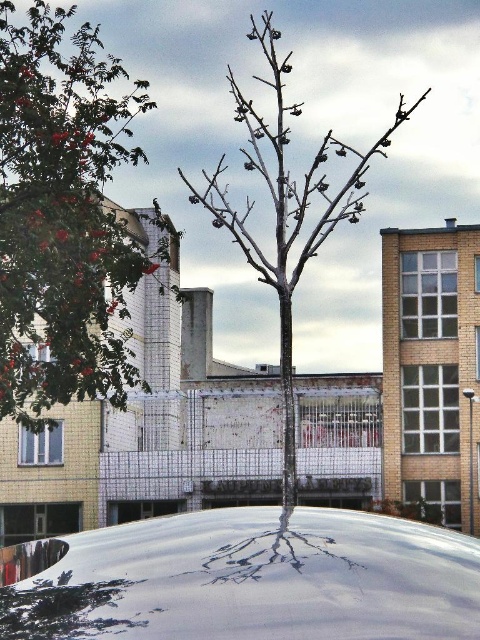
You are a city planner assessing the spacing between two trees in an urban area. The red glossy tree at upper left and the smooth gray tree at center are part of a green space. Given that the recommended minimum distance between trees is 40 feet for proper growth, does the current spacing meet the requirement?

The red glossy tree at upper left and smooth gray tree at center are 39.77 feet apart from each other, which is slightly less than the recommended 40 feet. Therefore, the current spacing does not fully meet the requirement for proper growth.

You are a delivery driver who needs to park your white glossy car at center in a space that can only accommodate vehicles up to the size of the smooth gray tree at center. Can your car fit in the space?

The white glossy car at center is smaller than the smooth gray tree at center, so yes, the car can fit in the space since it is smaller than the tree.

You are a city planner assessing the urban greenery. You need to determine which tree, the red glossy tree at upper left or the smooth gray tree at center, requires more space for growth. Based on their sizes, which one would likely need more space?

The smooth gray tree at center is larger than the red glossy tree at upper left, so it would likely require more space for growth.